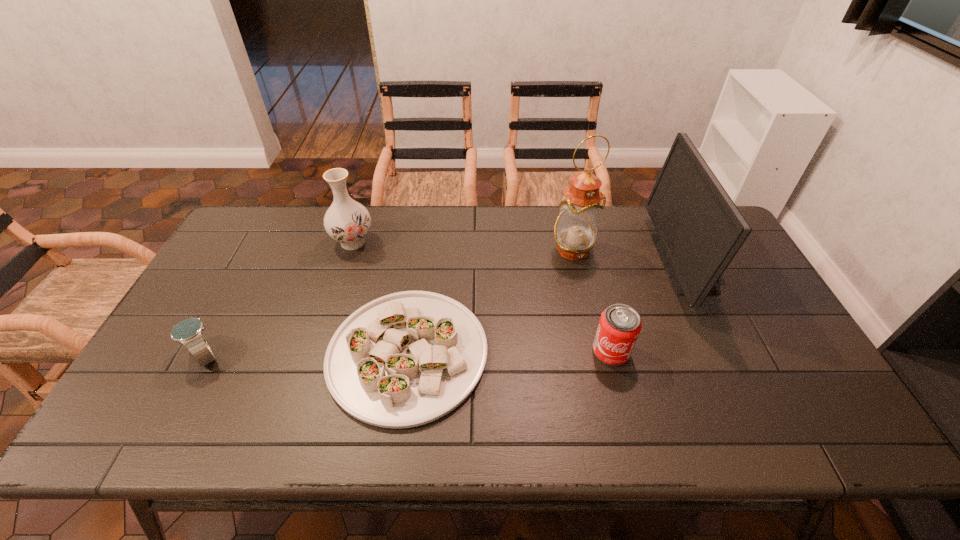
Locate an element on the screen. The height and width of the screenshot is (540, 960). empty location between the fifth tallest object and the third tallest object is located at coordinates (279, 299).

At what (x,y) coordinates should I click in order to perform the action: click on free spot between the second tallest object and the fourth shortest object. Please return your answer as a coordinate pair (x, y). This screenshot has width=960, height=540. Looking at the image, I should click on (520, 253).

Locate an element on the screen. The height and width of the screenshot is (540, 960). free spot between the fourth tallest object and the fourth shortest object is located at coordinates (482, 297).

Locate an element on the screen. vacant space that's between the computer monitor and the third shortest object is located at coordinates (649, 307).

This screenshot has width=960, height=540. In order to click on free space between the shortest object and the third shortest object in this screenshot , I will do `click(510, 353)`.

The width and height of the screenshot is (960, 540). I want to click on free space that is in between the second shortest object and the shortest object, so click(307, 355).

The image size is (960, 540). In order to click on the fifth closest object to the fourth tallest object in this screenshot , I will do `click(188, 332)`.

Select which object appears as the fourth closest to the rightmost object. Please provide its 2D coordinates. Your answer should be formatted as a tuple, i.e. [(x, y)], where the tuple contains the x and y coordinates of a point satisfying the conditions above.

[(347, 221)]

This screenshot has width=960, height=540. What are the coordinates of `vacant area in the image that satisfies the following two spatial constraints: 1. on the front side of the oil lamp; 2. on the right side of the fourth tallest object` in the screenshot? It's located at (595, 352).

At what (x,y) coordinates should I click in order to perform the action: click on free space that satisfies the following two spatial constraints: 1. on the back side of the watch; 2. on the left side of the fourth tallest object. Please return your answer as a coordinate pair (x, y). The height and width of the screenshot is (540, 960). Looking at the image, I should click on 208,352.